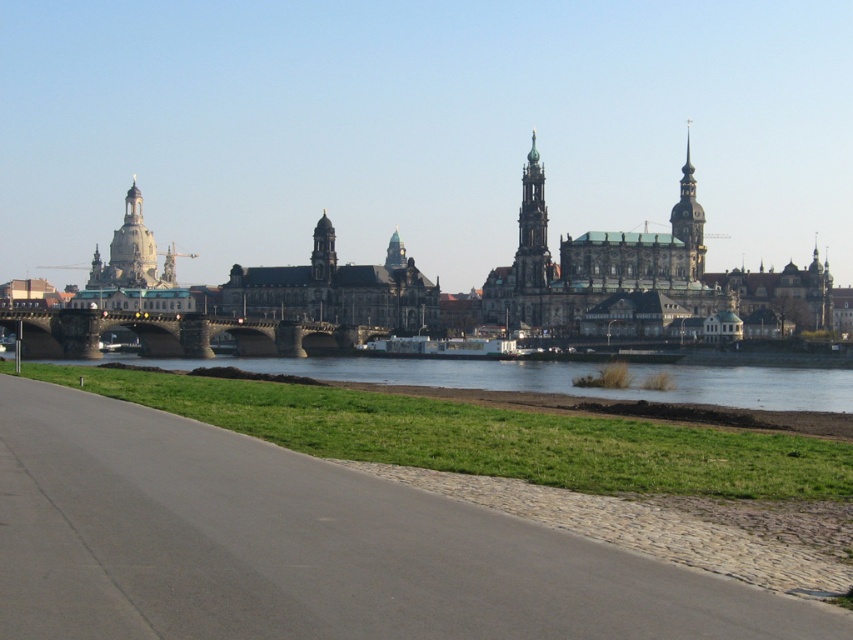
Does gray asphalt path at lower center appear under green grassy bank at lower center?

Indeed, gray asphalt path at lower center is positioned under green grassy bank at lower center.

What do you see at coordinates (305, 547) in the screenshot? I see `gray asphalt path at lower center` at bounding box center [305, 547].

What are the coordinates of `gray asphalt path at lower center` in the screenshot? It's located at (305, 547).

Is point (525, 241) positioned before point (679, 198)?

Yes, it is.

Which is above, smooth gold spire at center right or golden stone spire at upper right?

golden stone spire at upper right

What do you see at coordinates (532, 228) in the screenshot? I see `smooth gold spire at center right` at bounding box center [532, 228].

At what (x,y) coordinates should I click in order to perform the action: click on smooth gold spire at center right. Please return your answer as a coordinate pair (x, y). The width and height of the screenshot is (853, 640). Looking at the image, I should click on (532, 228).

Which is in front, point (753, 401) or point (328, 250)?

Positioned in front is point (753, 401).

Is point (316, 362) positioned behind point (323, 266)?

No, (316, 362) is in front of (323, 266).

Identify the location of green grassy bank at lower center. This screenshot has width=853, height=640. (558, 378).